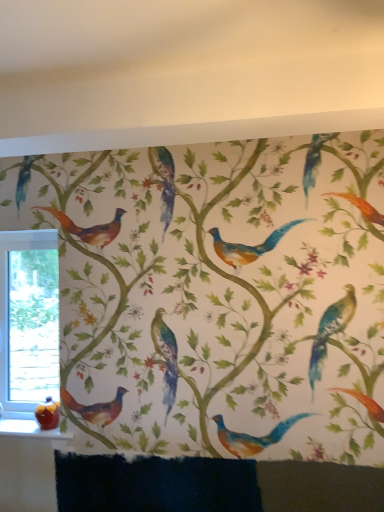
The image size is (384, 512). What are the coordinates of `clear glass window at left` in the screenshot? It's located at (28, 320).

The image size is (384, 512). What do you see at coordinates (28, 320) in the screenshot?
I see `clear glass window at left` at bounding box center [28, 320].

Find the location of a particular element. clear glass window at left is located at coordinates (28, 320).